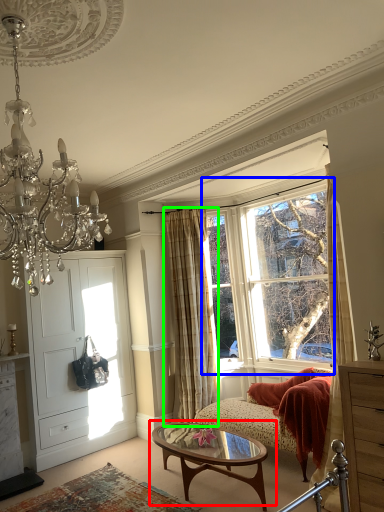
Question: Based on their relative distances, which object is nearer to coffee table (highlighted by a red box)? Choose from window (highlighted by a blue box) and curtain (highlighted by a green box).

Choices:
 (A) window
 (B) curtain

Answer: (B)